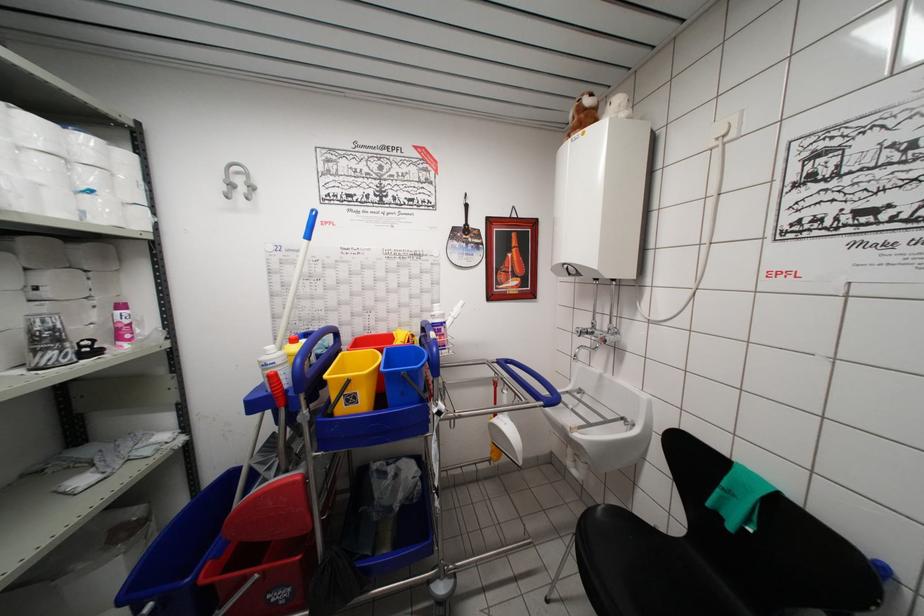
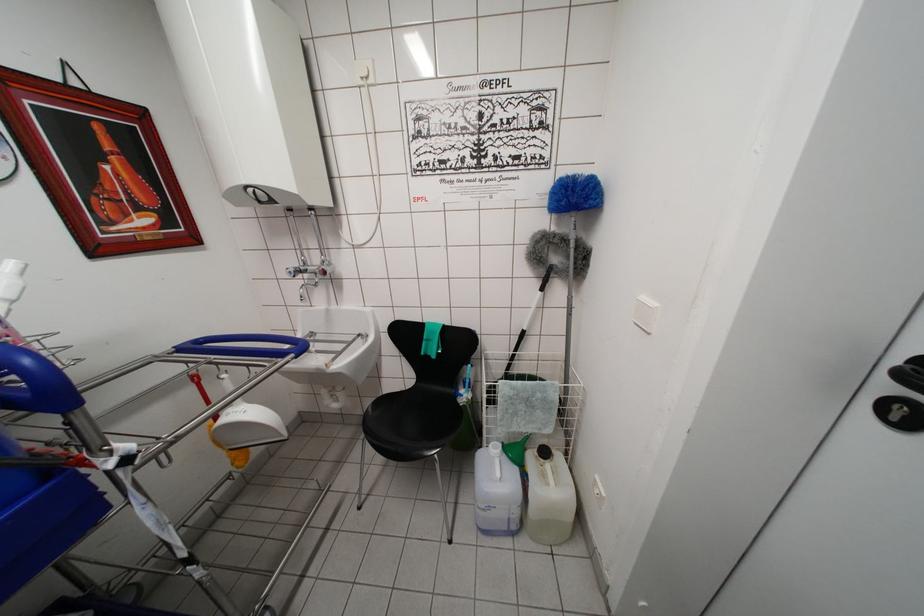
The point at [581,353] is marked in the first image. Where is the corresponding point in the second image?

(305, 292)